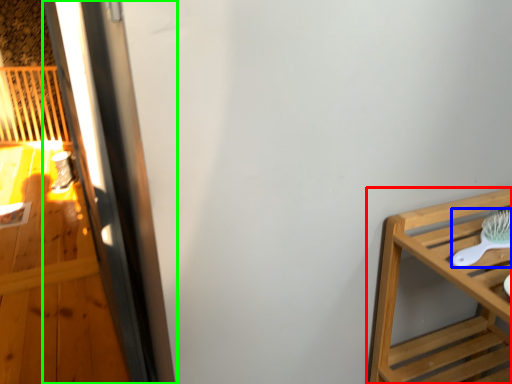
Question: Considering the real-world distances, which object is farthest from furniture (highlighted by a red box)? brush (highlighted by a blue box) or screen door (highlighted by a green box)?

Choices:
 (A) brush
 (B) screen door

Answer: (B)